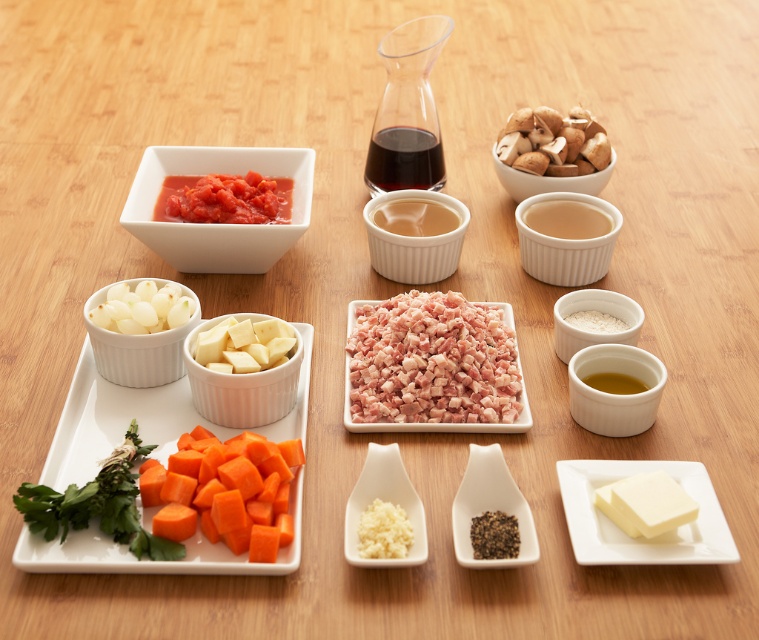
Is dark glossy liquid at center bigger than yellow creamy sauce at center right?

Yes.

Is dark glossy liquid at center thinner than yellow creamy sauce at center right?

Incorrect, dark glossy liquid at center's width is not less than yellow creamy sauce at center right's.

I want to click on dark glossy liquid at center, so click(405, 160).

The height and width of the screenshot is (640, 759). Find the location of `dark glossy liquid at center`. dark glossy liquid at center is located at coordinates (405, 160).

Who is higher up, matte white bowl at upper left or white translucent garlic cloves at upper left?

matte white bowl at upper left is higher up.

Is matte white bowl at upper left bigger than white translucent garlic cloves at upper left?

Correct, matte white bowl at upper left is larger in size than white translucent garlic cloves at upper left.

Identify the location of matte white bowl at upper left. (219, 224).

Does brown crumbly mushrooms at upper right lie in front of white matte bowl at center right?

No, it is not.

Is point (512, 157) more distant than point (580, 301)?

Yes.

In order to click on brown crumbly mushrooms at upper right in this screenshot , I will do `click(553, 141)`.